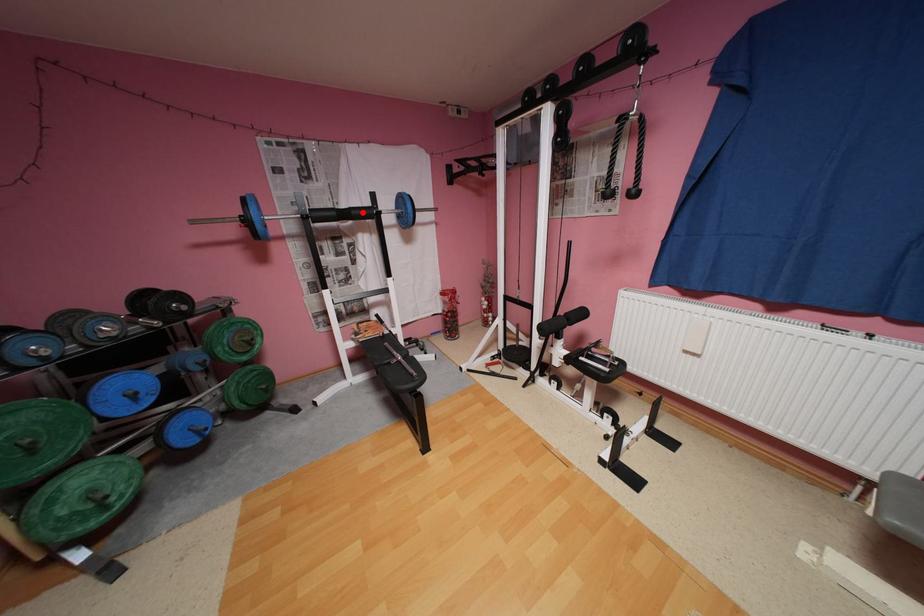
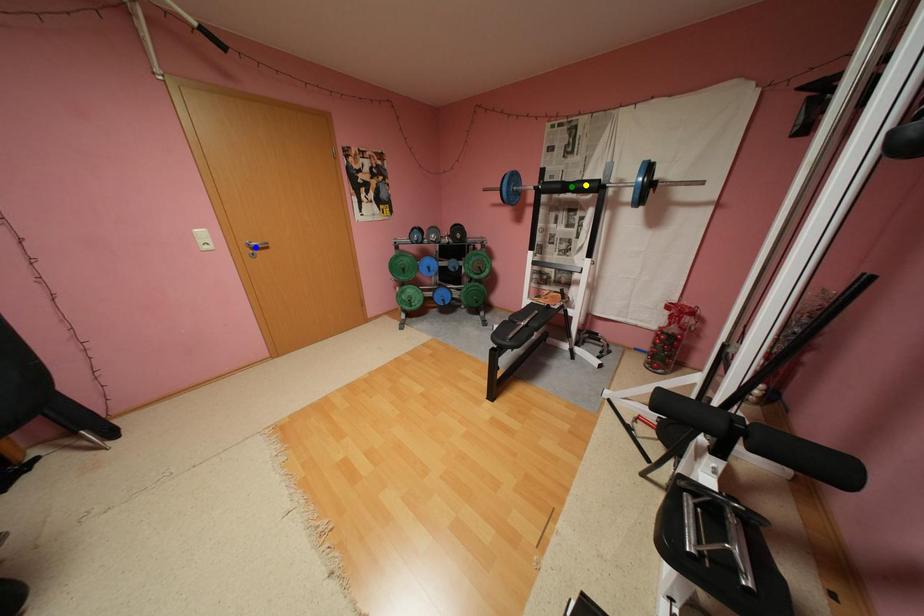
Question: I am providing you with two images of the same scene from different viewpoints. A red point is marked on the first image. You are given multiple points on the second image. Which spot in image 2 lines up with the point in image 1?

Choices:
 (A) green point
 (B) blue point
 (C) yellow point

Answer: (C)